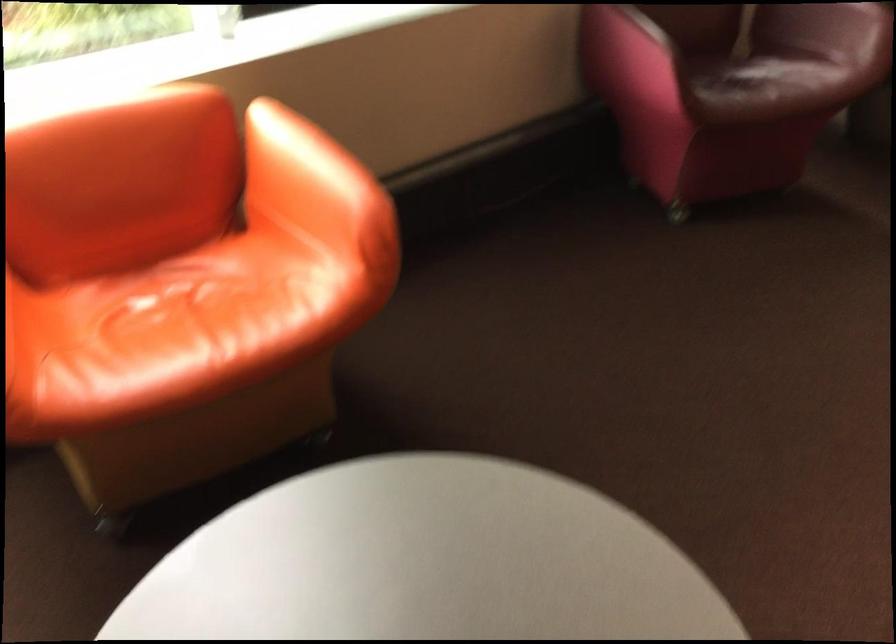
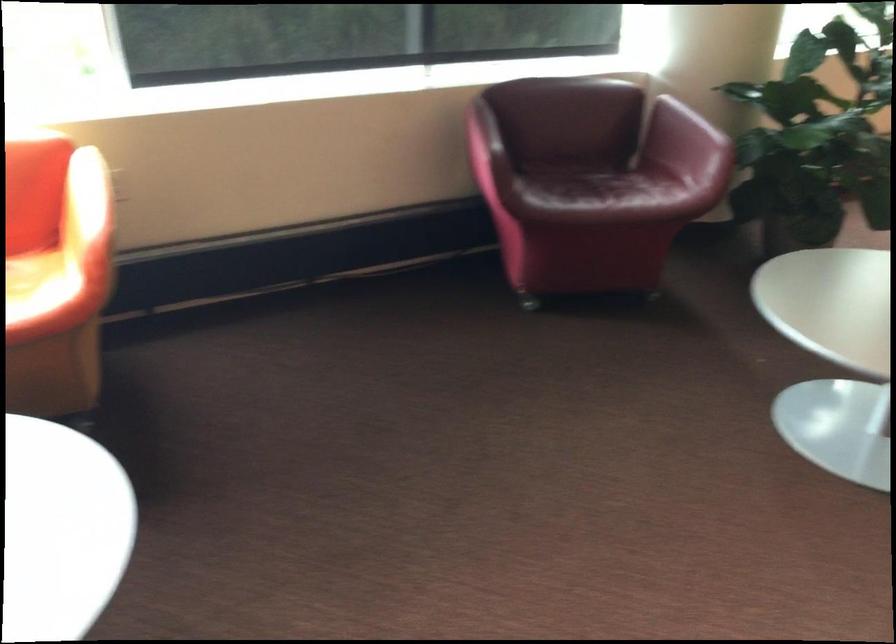
Find the pixel in the second image that matches the point at 330,169 in the first image.

(85, 200)